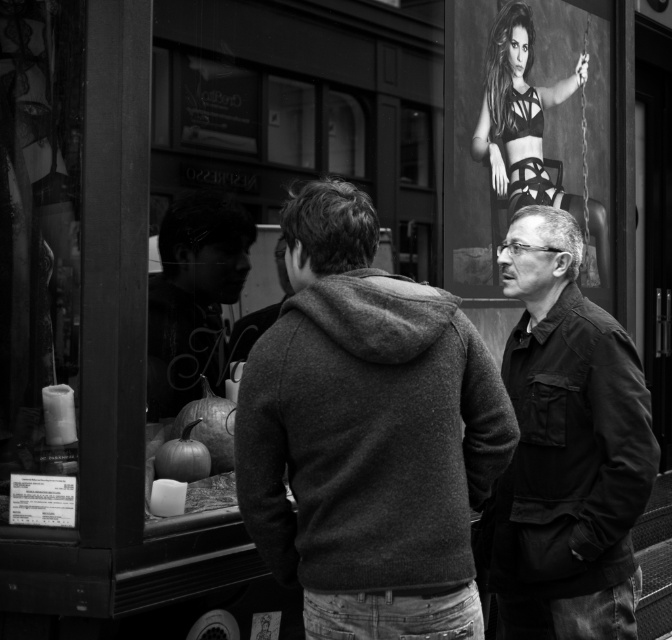
Question: Which point is farther from the camera taking this photo?

Choices:
 (A) pos(401,545)
 (B) pos(515,13)

Answer: (B)

Question: Considering the relative positions of textured black jacket at right and smooth black hoodie at center in the image provided, where is textured black jacket at right located with respect to smooth black hoodie at center?

Choices:
 (A) below
 (B) above

Answer: (A)

Question: Estimate the real-world distances between objects in this image. Which object is farther from the smooth black hoodie at center?

Choices:
 (A) matte black bra at upper center
 (B) textured black jacket at right

Answer: (A)

Question: Is textured gray hoodie at center closer to camera compared to textured black jacket at right?

Choices:
 (A) no
 (B) yes

Answer: (B)

Question: Estimate the real-world distances between objects in this image. Which object is closer to the matte black bra at upper center?

Choices:
 (A) smooth black hoodie at center
 (B) textured gray hoodie at center
 (C) textured black jacket at right

Answer: (C)

Question: Does textured black jacket at right have a greater width compared to matte black bra at upper center?

Choices:
 (A) yes
 (B) no

Answer: (B)